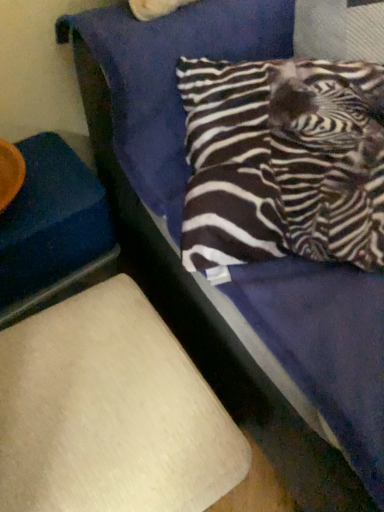
Question: Considering their positions, is zebra-patterned fabric pillow at upper right located in front of or behind blue fabric at left, which is counted as the 1th furniture, starting from the top?

Choices:
 (A) front
 (B) behind

Answer: (A)

Question: Considering the relative positions of zebra-patterned fabric pillow at upper right and blue fabric at left, which is counted as the 1th furniture, starting from the top, in the image provided, is zebra-patterned fabric pillow at upper right to the left or to the right of blue fabric at left, which is counted as the 1th furniture, starting from the top,?

Choices:
 (A) left
 (B) right

Answer: (B)

Question: Considering the real-world distances, which object is farthest from the blue fabric at left, which is counted as the 1th furniture, starting from the top?

Choices:
 (A) zebra-patterned fabric pillow at upper right
 (B) beige fabric lampshade at lower left, which ranks as the first furniture in bottom-to-top order

Answer: (A)

Question: Considering the real-world distances, which object is closest to the blue fabric at left, which appears as the 2th furniture when ordered from the bottom?

Choices:
 (A) zebra-patterned fabric pillow at upper right
 (B) beige fabric lampshade at lower left, the 2th furniture viewed from the top

Answer: (B)